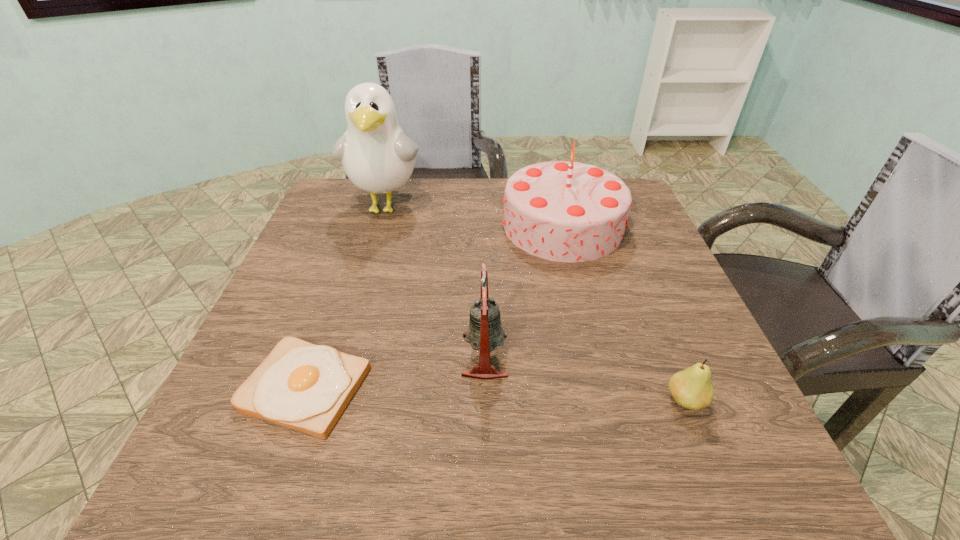
Identify the location of vacant space that satisfies the following two spatial constraints: 1. on the back side of the shortest object; 2. on the right side of the fourth shortest object. (363, 226).

You are a GUI agent. You are given a task and a screenshot of the screen. Output one action in this format:
    pyautogui.click(x=<x>, y=<y>)
    Task: Click on the vacant space that satisfies the following two spatial constraints: 1. on the beak of the bell; 2. on the right side of the gull
    
    Given the screenshot: What is the action you would take?
    pyautogui.click(x=342, y=355)

Find the location of a particular element. vacant space that satisfies the following two spatial constraints: 1. on the beak of the second shortest object; 2. on the right side of the tallest object is located at coordinates click(x=327, y=401).

Locate an element on the screen. The height and width of the screenshot is (540, 960). free space that satisfies the following two spatial constraints: 1. on the beak of the tallest object; 2. on the right side of the third object from left to right is located at coordinates (342, 355).

The width and height of the screenshot is (960, 540). Identify the location of blank area in the image that satisfies the following two spatial constraints: 1. on the beak of the gull; 2. on the right side of the pear. (327, 401).